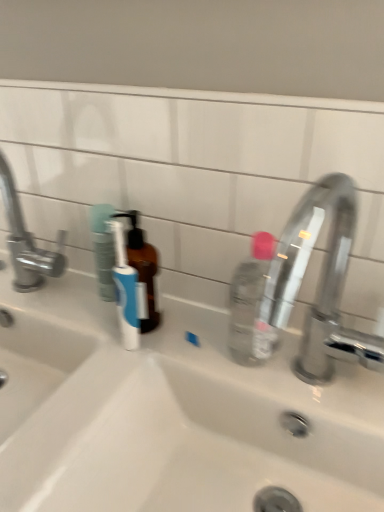
The image size is (384, 512). Identify the location of polished chrome faucet at right, arranged as the 1th tap when viewed from the right. (319, 282).

Could you measure the distance between white ceramic sink at center and brushed metal faucet at left, acting as the second tap starting from the right?

The distance of white ceramic sink at center from brushed metal faucet at left, acting as the second tap starting from the right, is 12.25 inches.

From the image's perspective, is white ceramic sink at center beneath brushed metal faucet at left, which is the first tap in left-to-right order?

Yes, from the image's perspective, white ceramic sink at center is below brushed metal faucet at left, which is the first tap in left-to-right order.

Considering the sizes of white ceramic sink at center and brushed metal faucet at left, acting as the second tap starting from the right, in the image, is white ceramic sink at center taller or shorter than brushed metal faucet at left, acting as the second tap starting from the right,?

Considering their sizes, white ceramic sink at center has more height than brushed metal faucet at left, acting as the second tap starting from the right.

Is white ceramic sink at center not within brushed metal faucet at left, which is the first tap in left-to-right order?

Yes, white ceramic sink at center is located beyond the bounds of brushed metal faucet at left, which is the first tap in left-to-right order.

Considering the relative sizes of white ceramic sink at center and polished chrome faucet at right, arranged as the 1th tap when viewed from the right, in the image provided, is white ceramic sink at center shorter than polished chrome faucet at right, arranged as the 1th tap when viewed from the right,?

In fact, white ceramic sink at center may be taller than polished chrome faucet at right, arranged as the 1th tap when viewed from the right.

Considering the positions of point (141, 422) and point (329, 374), is point (141, 422) closer or farther from the camera than point (329, 374)?

Point (141, 422) is farther from the camera than point (329, 374).

How different are the orientations of white ceramic sink at center and polished chrome faucet at right, which is counted as the second tap, starting from the left, in degrees?

0.184 degrees.

Considering the positions of objects white ceramic sink at center and polished chrome faucet at right, which is counted as the second tap, starting from the left, in the image provided, who is in front, white ceramic sink at center or polished chrome faucet at right, which is counted as the second tap, starting from the left,?

white ceramic sink at center is in front.

From the image's perspective, is polished chrome faucet at right, arranged as the 1th tap when viewed from the right, above or below brushed metal faucet at left, acting as the second tap starting from the right?

Based on their image positions, polished chrome faucet at right, arranged as the 1th tap when viewed from the right, is located beneath brushed metal faucet at left, acting as the second tap starting from the right.

Looking at their sizes, would you say polished chrome faucet at right, arranged as the 1th tap when viewed from the right, is wider or thinner than brushed metal faucet at left, which is the first tap in left-to-right order?

Considering their sizes, polished chrome faucet at right, arranged as the 1th tap when viewed from the right, looks broader than brushed metal faucet at left, which is the first tap in left-to-right order.

From a real-world perspective, who is located lower, polished chrome faucet at right, arranged as the 1th tap when viewed from the right, or brushed metal faucet at left, acting as the second tap starting from the right?

polished chrome faucet at right, arranged as the 1th tap when viewed from the right, is physically lower.

Between polished chrome faucet at right, arranged as the 1th tap when viewed from the right, and brushed metal faucet at left, acting as the second tap starting from the right, which one has smaller size?

Smaller between the two is brushed metal faucet at left, acting as the second tap starting from the right.

Is brushed metal faucet at left, which is the first tap in left-to-right order, far away from white ceramic sink at center?

No, brushed metal faucet at left, which is the first tap in left-to-right order, is not far away from white ceramic sink at center.

Based on the photo, from a real-world perspective, is brushed metal faucet at left, which is the first tap in left-to-right order, physically located above or below white ceramic sink at center?

brushed metal faucet at left, which is the first tap in left-to-right order, is above white ceramic sink at center.

From a real-world perspective, which tap is the 2nd one above the white ceramic sink at center? Please provide its 2D coordinates.

[(27, 241)]

Who is more distant, polished chrome faucet at right, which is counted as the second tap, starting from the left, or white ceramic sink at center?

polished chrome faucet at right, which is counted as the second tap, starting from the left, is further from the camera.

Where is `sink in front of the polished chrome faucet at right, arranged as the 1th tap when viewed from the right`? The image size is (384, 512). sink in front of the polished chrome faucet at right, arranged as the 1th tap when viewed from the right is located at coordinates (170, 414).

Is polished chrome faucet at right, which is counted as the second tap, starting from the left, shorter than white ceramic sink at center?

Yes.

Considering the positions of point (14, 286) and point (307, 211), is point (14, 286) closer or farther from the camera than point (307, 211)?

Point (14, 286) is farther from the camera than point (307, 211).

In the scene shown: Who is smaller, brushed metal faucet at left, acting as the second tap starting from the right, or polished chrome faucet at right, arranged as the 1th tap when viewed from the right?

brushed metal faucet at left, acting as the second tap starting from the right, is smaller.

Considering the positions of objects brushed metal faucet at left, which is the first tap in left-to-right order, and polished chrome faucet at right, which is counted as the second tap, starting from the left, in the image provided, who is more to the left, brushed metal faucet at left, which is the first tap in left-to-right order, or polished chrome faucet at right, which is counted as the second tap, starting from the left,?

Positioned to the left is brushed metal faucet at left, which is the first tap in left-to-right order.

Is brushed metal faucet at left, which is the first tap in left-to-right order, not within polished chrome faucet at right, which is counted as the second tap, starting from the left?

brushed metal faucet at left, which is the first tap in left-to-right order, lies outside polished chrome faucet at right, which is counted as the second tap, starting from the left,'s area.

At what (x,y) coordinates should I click in order to perform the action: click on tap on the left of white ceramic sink at center. Please return your answer as a coordinate pair (x, y). The height and width of the screenshot is (512, 384). Looking at the image, I should click on click(x=27, y=241).

This screenshot has height=512, width=384. Identify the location of tap that is the 1st object above the white ceramic sink at center (from a real-world perspective). (319, 282).

Consider the image. Estimate the real-world distances between objects in this image. Which object is further from white ceramic sink at center, brushed metal faucet at left, which is the first tap in left-to-right order, or polished chrome faucet at right, which is counted as the second tap, starting from the left?

brushed metal faucet at left, which is the first tap in left-to-right order, lies further to white ceramic sink at center than the other object.

Estimate the real-world distances between objects in this image. Which object is further from polished chrome faucet at right, which is counted as the second tap, starting from the left, brushed metal faucet at left, acting as the second tap starting from the right, or white ceramic sink at center?

Based on the image, brushed metal faucet at left, acting as the second tap starting from the right, appears to be further to polished chrome faucet at right, which is counted as the second tap, starting from the left.

When comparing their distances from brushed metal faucet at left, which is the first tap in left-to-right order, does white ceramic sink at center or polished chrome faucet at right, arranged as the 1th tap when viewed from the right, seem closer?

white ceramic sink at center is closer to brushed metal faucet at left, which is the first tap in left-to-right order.

Based on their spatial positions, is white ceramic sink at center or brushed metal faucet at left, acting as the second tap starting from the right, further from polished chrome faucet at right, which is counted as the second tap, starting from the left?

The object further to polished chrome faucet at right, which is counted as the second tap, starting from the left, is brushed metal faucet at left, acting as the second tap starting from the right.

When comparing their distances from brushed metal faucet at left, acting as the second tap starting from the right, does polished chrome faucet at right, arranged as the 1th tap when viewed from the right, or white ceramic sink at center seem closer?

white ceramic sink at center lies closer to brushed metal faucet at left, acting as the second tap starting from the right, than the other object.

Looking at the image, which one is located closer to white ceramic sink at center, polished chrome faucet at right, which is counted as the second tap, starting from the left, or brushed metal faucet at left, acting as the second tap starting from the right?

polished chrome faucet at right, which is counted as the second tap, starting from the left, is closer to white ceramic sink at center.

Where is `sink between brushed metal faucet at left, which is the first tap in left-to-right order, and polished chrome faucet at right, which is counted as the second tap, starting from the left`? The height and width of the screenshot is (512, 384). sink between brushed metal faucet at left, which is the first tap in left-to-right order, and polished chrome faucet at right, which is counted as the second tap, starting from the left is located at coordinates (170, 414).